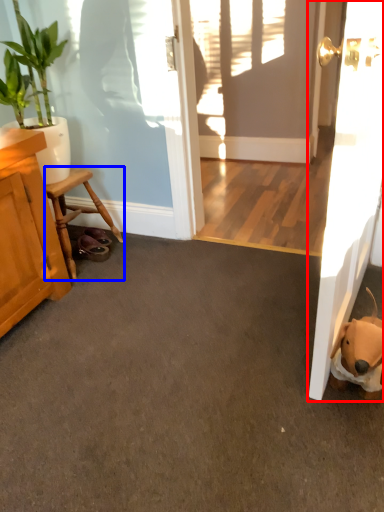
Question: Among these objects, which one is nearest to the camera, door (highlighted by a red box) or furniture (highlighted by a blue box)?

Choices:
 (A) door
 (B) furniture

Answer: (A)